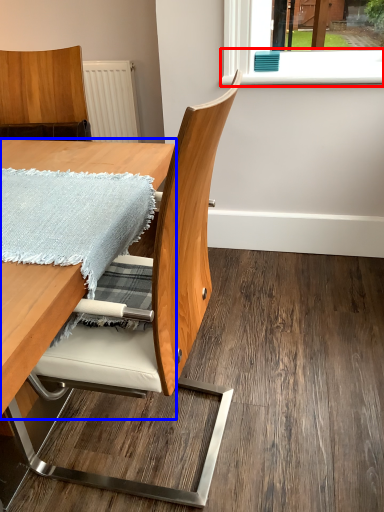
Question: Which point is further to the camera, window sill (highlighted by a red box) or table (highlighted by a blue box)?

Choices:
 (A) window sill
 (B) table

Answer: (A)